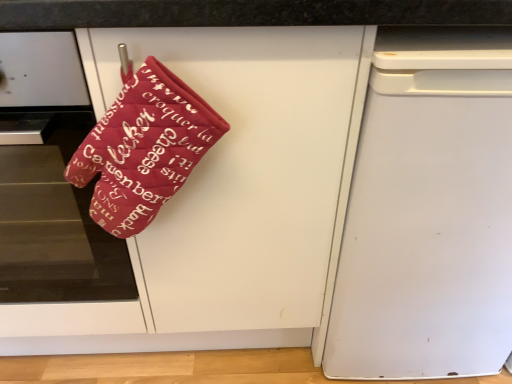
The height and width of the screenshot is (384, 512). What do you see at coordinates (53, 191) in the screenshot? I see `velvet red oven mitt at left` at bounding box center [53, 191].

The image size is (512, 384). I want to click on velvet red oven mitt at left, so click(x=53, y=191).

From the picture: Which of these two, velvet red oven mitt at left or matte red oven mitt at upper left, stands taller?

With more height is matte red oven mitt at upper left.

Is velvet red oven mitt at left with matte red oven mitt at upper left?

No, velvet red oven mitt at left is not in contact with matte red oven mitt at upper left.

Image resolution: width=512 pixels, height=384 pixels. What are the coordinates of `home appliance that is above the matte red oven mitt at upper left (from the image's perspective)` in the screenshot? It's located at (53, 191).

Which object is further away from the camera, velvet red oven mitt at left or matte red oven mitt at upper left?

velvet red oven mitt at left.

Could you tell me if matte red oven mitt at upper left is facing velvet red oven mitt at left?

Yes, matte red oven mitt at upper left is oriented towards velvet red oven mitt at left.

Is matte red oven mitt at upper left positioned behind velvet red oven mitt at left?

No, the depth of matte red oven mitt at upper left is less than that of velvet red oven mitt at left.

Considering the sizes of matte red oven mitt at upper left and velvet red oven mitt at left in the image, is matte red oven mitt at upper left wider or thinner than velvet red oven mitt at left?

matte red oven mitt at upper left is wider than velvet red oven mitt at left.

Between white matte dishwasher at right and velvet red oven mitt at left, which one has smaller size?

velvet red oven mitt at left.

How different are the orientations of white matte dishwasher at right and velvet red oven mitt at left in degrees?

There is a 0.143-degree angle between the facing directions of white matte dishwasher at right and velvet red oven mitt at left.

Find the location of a particular element. The image size is (512, 384). home appliance that is in front of the white matte dishwasher at right is located at coordinates (53, 191).

From a real-world perspective, is white matte dishwasher at right positioned above or below velvet red oven mitt at left?

white matte dishwasher at right is situated lower than velvet red oven mitt at left in the real world.

Looking at this image, is matte red oven mitt at upper left further to camera compared to white matte dishwasher at right?

No, the depth of matte red oven mitt at upper left is less than that of white matte dishwasher at right.

Consider the image. Considering the sizes of objects matte red oven mitt at upper left and white matte dishwasher at right in the image provided, who is wider, matte red oven mitt at upper left or white matte dishwasher at right?

With larger width is matte red oven mitt at upper left.

From a real-world perspective, which object stands above the other?

In real-world perspective, matte red oven mitt at upper left is above.

Is matte red oven mitt at upper left facing towards white matte dishwasher at right?

No, matte red oven mitt at upper left is not aimed at white matte dishwasher at right.

Measure the distance from velvet red oven mitt at left to white matte dishwasher at right.

velvet red oven mitt at left is 25.09 inches from white matte dishwasher at right.

In the image, is velvet red oven mitt at left positioned in front of or behind white matte dishwasher at right?

velvet red oven mitt at left is in front of white matte dishwasher at right.

Is velvet red oven mitt at left completely or partially outside of white matte dishwasher at right?

Yes, velvet red oven mitt at left is located beyond the bounds of white matte dishwasher at right.

Looking at this image, considering the sizes of velvet red oven mitt at left and white matte dishwasher at right in the image, is velvet red oven mitt at left wider or thinner than white matte dishwasher at right?

In the image, velvet red oven mitt at left appears to be more narrow than white matte dishwasher at right.

From a real-world perspective, who is located lower, white matte dishwasher at right or matte red oven mitt at upper left?

From a 3D spatial view, white matte dishwasher at right is below.

From the image's perspective, does white matte dishwasher at right appear lower than matte red oven mitt at upper left?

No, from the image's perspective, white matte dishwasher at right is not below matte red oven mitt at upper left.

Can you confirm if white matte dishwasher at right is smaller than matte red oven mitt at upper left?

Correct, white matte dishwasher at right occupies less space than matte red oven mitt at upper left.

I want to click on door below the velvet red oven mitt at left (from a real-world perspective), so click(245, 171).

You are a GUI agent. You are given a task and a screenshot of the screen. Output one action in this format:
    pyautogui.click(x=<x>, y=<y>)
    Task: Click on the home appliance on the left of matte red oven mitt at upper left
    This screenshot has width=512, height=384.
    Given the screenshot: What is the action you would take?
    53,191

When comparing their distances from velvet red oven mitt at left, does matte red oven mitt at upper left or white matte dishwasher at right seem further?

white matte dishwasher at right is positioned further to the anchor velvet red oven mitt at left.

Which object lies further to the anchor point matte red oven mitt at upper left, velvet red oven mitt at left or white matte dishwasher at right?

velvet red oven mitt at left.

When comparing their distances from white matte dishwasher at right, does velvet red oven mitt at left or matte red oven mitt at upper left seem further?

velvet red oven mitt at left is further to white matte dishwasher at right.

Based on their spatial positions, is white matte dishwasher at right or matte red oven mitt at upper left further from velvet red oven mitt at left?

Based on the image, white matte dishwasher at right appears to be further to velvet red oven mitt at left.

Based on their spatial positions, is matte red oven mitt at upper left or velvet red oven mitt at left further from white matte dishwasher at right?

velvet red oven mitt at left lies further to white matte dishwasher at right than the other object.

From the image, which object appears to be farther from matte red oven mitt at upper left, white matte dishwasher at right or velvet red oven mitt at left?

velvet red oven mitt at left.

What are the coordinates of `door situated between velvet red oven mitt at left and white matte dishwasher at right from left to right` in the screenshot? It's located at (245, 171).